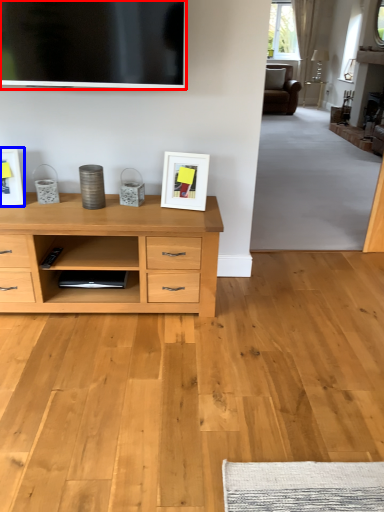
Question: Which point is closer to the camera, television (highlighted by a red box) or picture frame (highlighted by a blue box)?

Choices:
 (A) television
 (B) picture frame

Answer: (A)